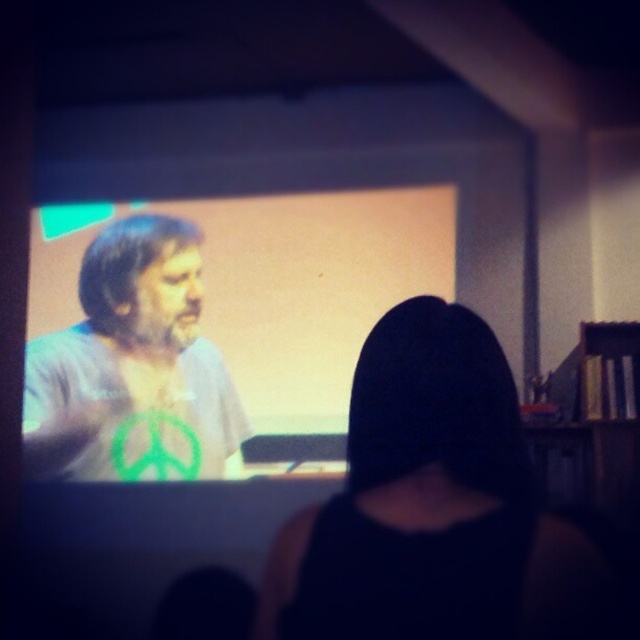
Question: Which point appears farthest from the camera in this image?

Choices:
 (A) (481, 324)
 (B) (164, 292)

Answer: (B)

Question: Is black matte hair at center thinner than green fabric shirt at center?

Choices:
 (A) yes
 (B) no

Answer: (A)

Question: Where is black matte hair at center located in relation to green fabric shirt at center in the image?

Choices:
 (A) below
 (B) above

Answer: (A)

Question: Which point is closer to the camera?

Choices:
 (A) green fabric shirt at center
 (B) black matte hair at center

Answer: (B)

Question: Does black matte hair at center appear on the right side of green fabric shirt at center?

Choices:
 (A) yes
 (B) no

Answer: (A)